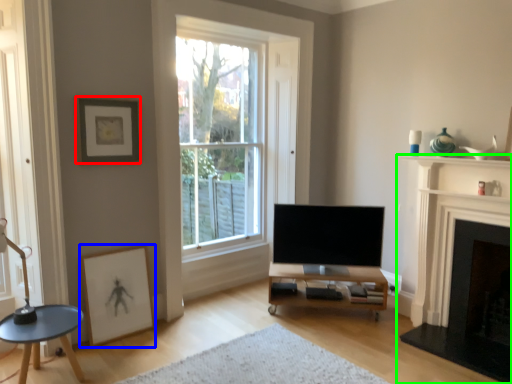
Question: Estimate the real-world distances between objects in this image. Which object is farther from picture frame (highlighted by a red box), picture frame (highlighted by a blue box) or fireplace (highlighted by a green box)?

Choices:
 (A) picture frame
 (B) fireplace

Answer: (B)